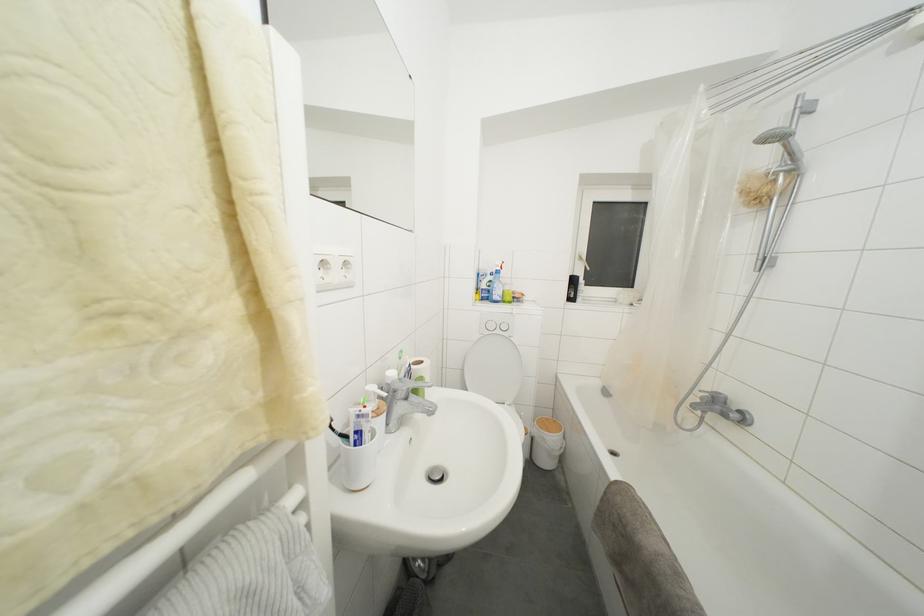
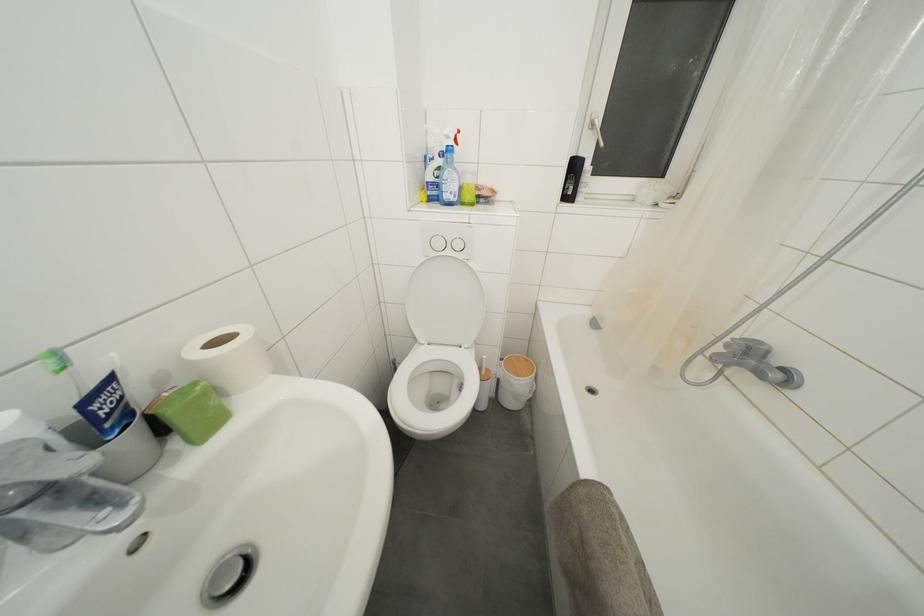
Where in the second image is the point corresponding to [585,264] from the first image?

(597, 131)